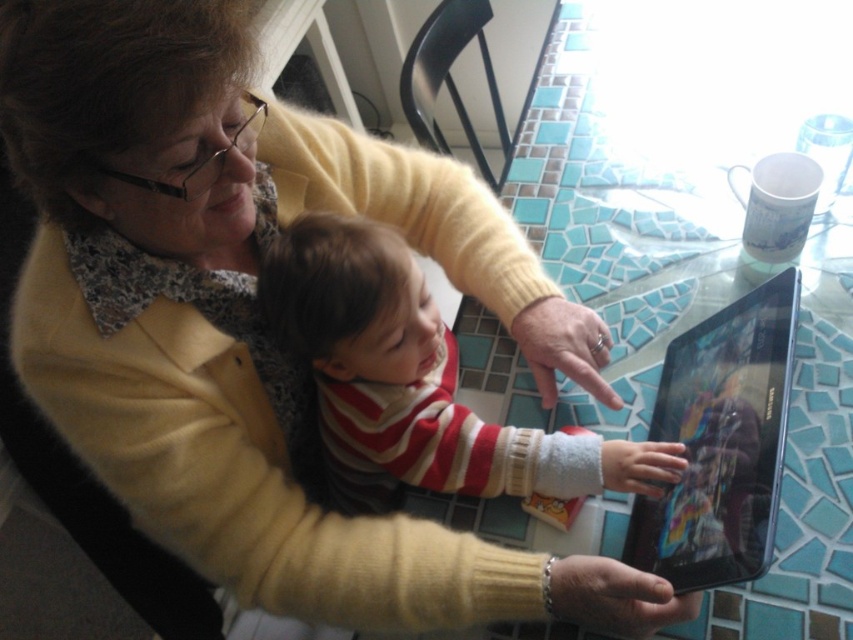
Question: Among these points, which one is farthest from the camera?

Choices:
 (A) (712, 444)
 (B) (291, 292)

Answer: (A)

Question: Is striped sweater at center positioned before black glossy tablet at center?

Choices:
 (A) yes
 (B) no

Answer: (B)

Question: Is striped sweater at center to the right of black glossy tablet at center from the viewer's perspective?

Choices:
 (A) no
 (B) yes

Answer: (A)

Question: Can you confirm if striped sweater at center is positioned above black glossy tablet at center?

Choices:
 (A) no
 (B) yes

Answer: (B)

Question: Among these objects, which one is nearest to the camera?

Choices:
 (A) striped sweater at center
 (B) black glossy tablet at center

Answer: (B)